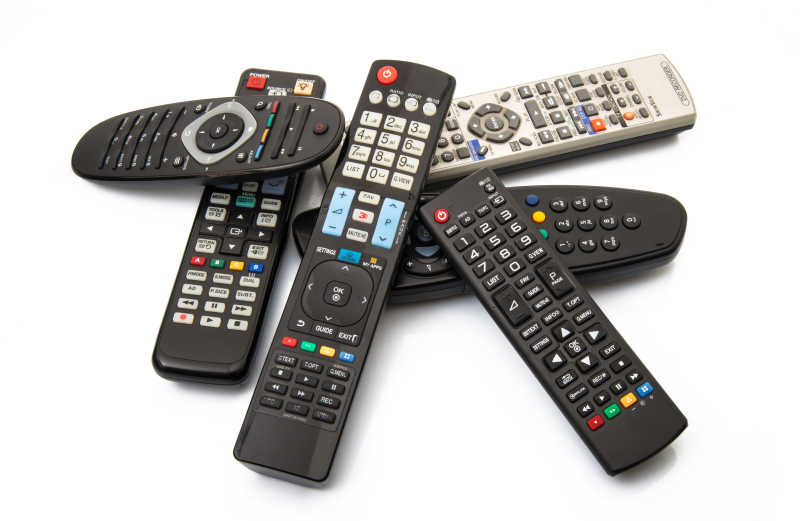
This screenshot has height=521, width=800. In order to click on remote control in this screenshot , I will do `click(630, 86)`, `click(610, 229)`, `click(574, 340)`, `click(365, 257)`, `click(238, 260)`, `click(246, 132)`.